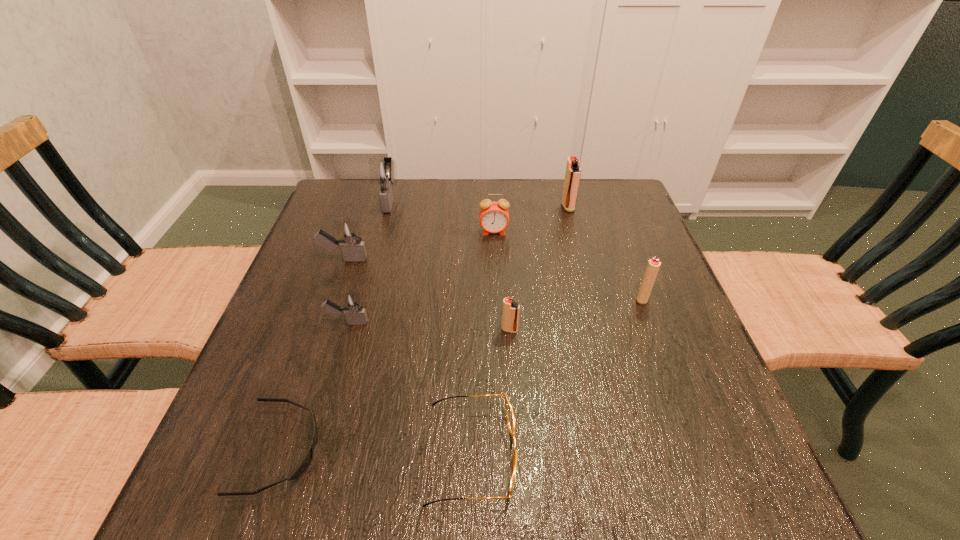
Where is `the third igniter from right to left`? This screenshot has width=960, height=540. the third igniter from right to left is located at coordinates (510, 317).

Where is `the nearest gray igniter`? The height and width of the screenshot is (540, 960). the nearest gray igniter is located at coordinates (352, 306).

At what (x,y) coordinates should I click in order to perform the action: click on gold spectacles. Please return your answer as a coordinate pair (x, y). The width and height of the screenshot is (960, 540). Looking at the image, I should click on (510, 417).

Locate an element on the screen. The height and width of the screenshot is (540, 960). spectacles is located at coordinates (510, 417).

The width and height of the screenshot is (960, 540). I want to click on sunglasses, so click(x=308, y=457).

You are a GUI agent. You are given a task and a screenshot of the screen. Output one action in this format:
    pyautogui.click(x=<x>, y=<y>)
    Task: Click on the vacant space situated 0.060m on the right of the farthest red igniter
    
    Given the screenshot: What is the action you would take?
    pyautogui.click(x=595, y=207)

Image resolution: width=960 pixels, height=540 pixels. I want to click on free space located 0.170m on the front of the farthest gray igniter, so click(376, 254).

You are a GUI agent. You are given a task and a screenshot of the screen. Output one action in this format:
    pyautogui.click(x=<x>, y=<y>)
    Task: Click on the vacant space located on the back of the sixth nearest object
    
    Given the screenshot: What is the action you would take?
    pyautogui.click(x=368, y=191)

Locate an element on the screen. The image size is (960, 540). free space located 0.130m on the front of the second farthest red igniter is located at coordinates (662, 353).

You are a GUI agent. You are given a task and a screenshot of the screen. Output one action in this format:
    pyautogui.click(x=<x>, y=<y>)
    Task: Click on the free space located 0.250m on the face of the seventh nearest object
    
    Given the screenshot: What is the action you would take?
    pyautogui.click(x=497, y=306)